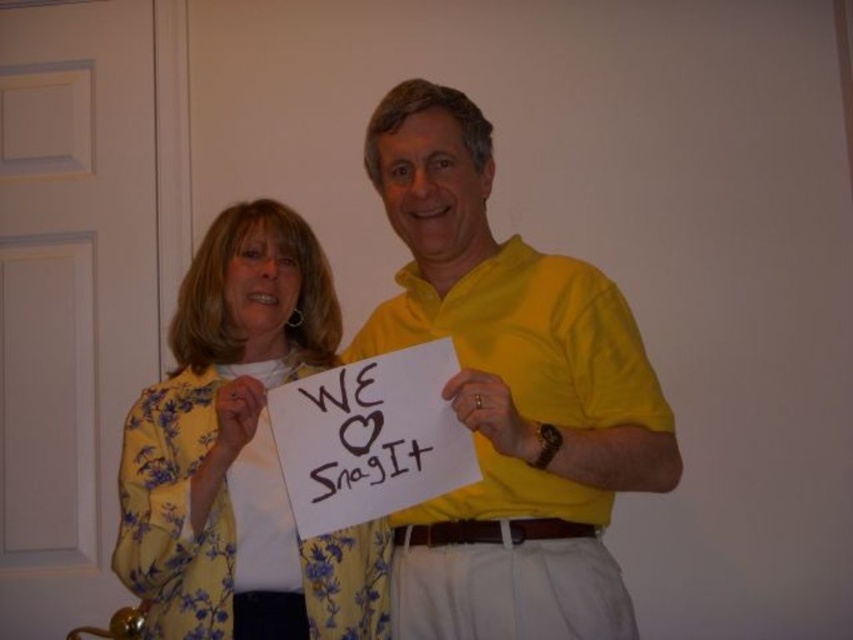
Which is above, yellow matte shirt at center or yellow floral blouse at center?

yellow matte shirt at center is above.

Which is in front, point (573, 406) or point (318, 605)?

Positioned in front is point (318, 605).

Locate an element on the screen. Image resolution: width=853 pixels, height=640 pixels. yellow matte shirt at center is located at coordinates (508, 396).